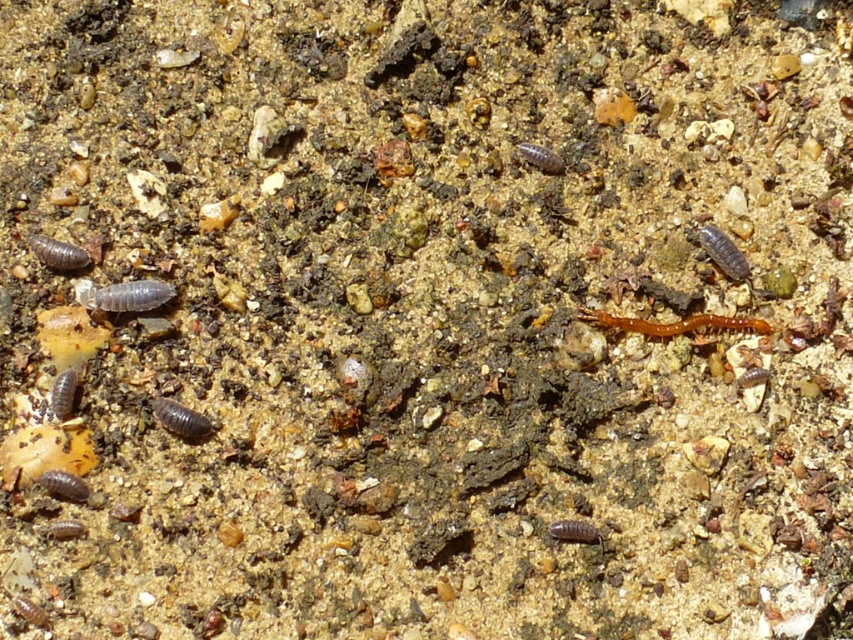
Question: Which of the following is the closest to the observer?

Choices:
 (A) shiny black worm at center
 (B) brown matte worm at lower left

Answer: (B)

Question: Does translucent gray worm at center appear under shiny brown worm at lower left?

Choices:
 (A) yes
 (B) no

Answer: (B)

Question: Which object appears closest to the camera in this image?

Choices:
 (A) matte gray worm at left
 (B) brown matte worm at lower left
 (C) smooth brown worm at right
 (D) shiny black worm at center

Answer: (B)

Question: Which is farther from the brown matte worm at center-right?

Choices:
 (A) orange matte centipede at center
 (B) smooth brown worm at lower left

Answer: (B)

Question: Is smooth brown worm at right to the right of brown matte worm at center-right from the viewer's perspective?

Choices:
 (A) yes
 (B) no

Answer: (B)

Question: Is shiny black worm at center smaller than smooth brown worm at lower left?

Choices:
 (A) yes
 (B) no

Answer: (B)